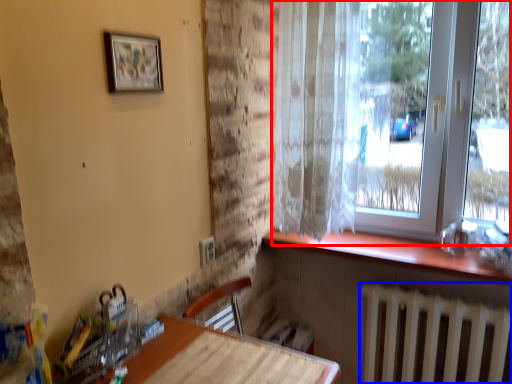
Question: Which of the following is the closest to the observer, window (highlighted by a red box) or radiator (highlighted by a blue box)?

Choices:
 (A) window
 (B) radiator

Answer: (A)